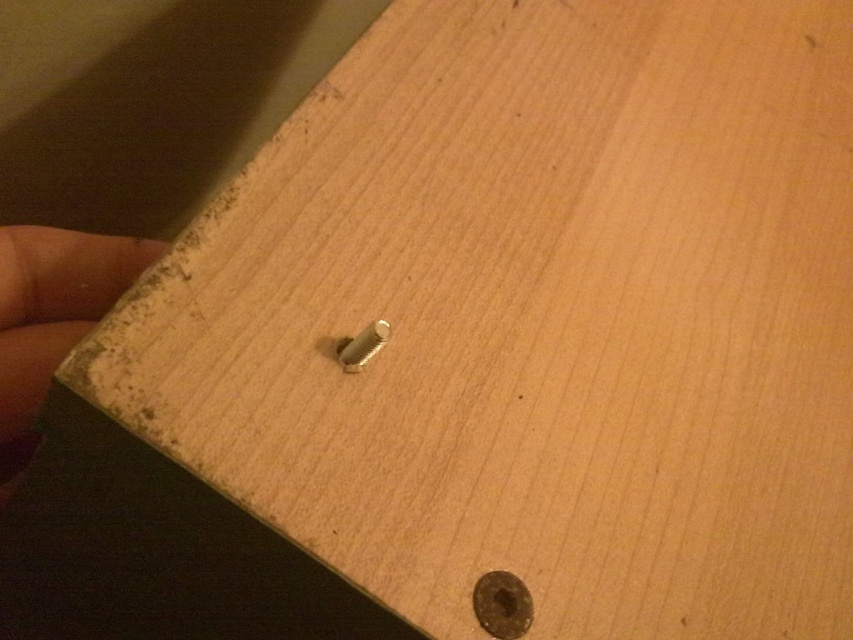
You are a carpenter working on a wooden surface. You need to place a new bolt exactly where the gold metallic bolt at center is currently positioned. What are the coordinates of the location where you should place the new bolt?

The gold metallic bolt at center is located at point (502, 604), so you should place the new bolt at those coordinates.

You are standing at the edge of the wooden surface and want to place a small object on the point that is closer to you. Which point should you choose between point (100, 307) and point (514, 620)?

Point (514, 620) is closer to you, so you should choose point (514, 620).

You are looking at the wooden surface and see two points marked on it. Which point is closer to you, point (112, 252) or point (350, 356)?

Point (112, 252) is further to the camera than point (350, 356), so point (350, 356) is closer to you.